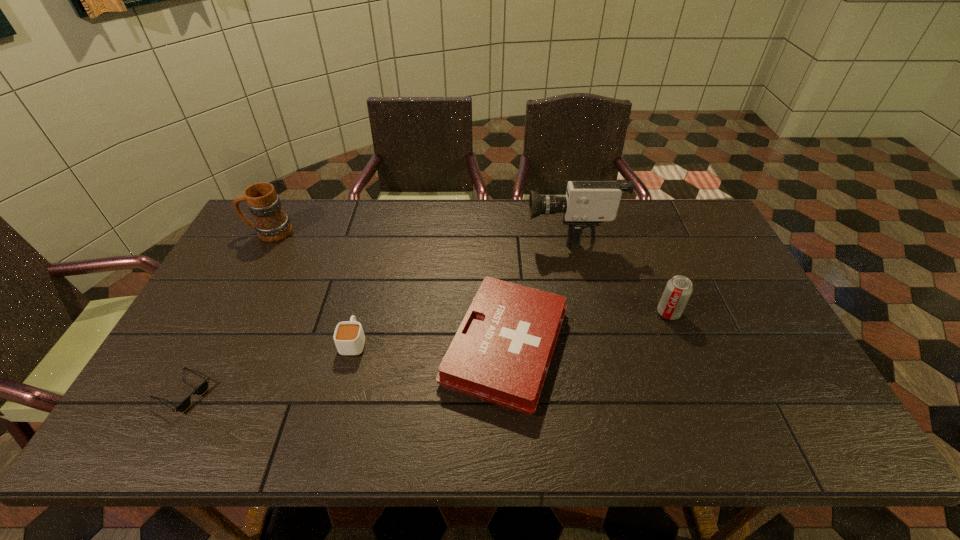
Locate an element on the screen. The width and height of the screenshot is (960, 540). camcorder is located at coordinates (587, 203).

I want to click on the second tallest object, so click(271, 223).

This screenshot has height=540, width=960. Identify the location of soda can. (678, 290).

Where is `the rightmost object`? the rightmost object is located at coordinates (678, 290).

Where is `the third object from left to right`? The height and width of the screenshot is (540, 960). the third object from left to right is located at coordinates (349, 338).

Locate an element on the screen. the first-aid kit is located at coordinates (501, 353).

Locate an element on the screen. sunglasses is located at coordinates (200, 390).

Image resolution: width=960 pixels, height=540 pixels. Identify the location of free space located 0.050m on the recording direction of the tallest object. (511, 231).

I want to click on vacant space located 0.350m on the recording direction of the tallest object, so click(421, 231).

Locate an element on the screen. free region located 0.360m on the recording direction of the tallest object is located at coordinates (419, 231).